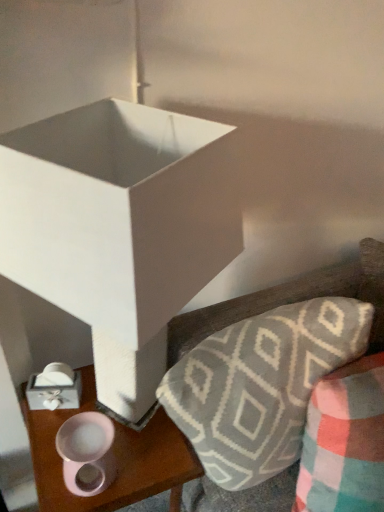
Question: Is pink matte candle holder at lower left next to textured gray pillow at upper right and touching it?

Choices:
 (A) yes
 (B) no

Answer: (B)

Question: Would you say pink matte candle holder at lower left is a long distance from textured gray pillow at upper right?

Choices:
 (A) no
 (B) yes

Answer: (A)

Question: Is textured gray pillow at upper right a part of pink matte candle holder at lower left?

Choices:
 (A) no
 (B) yes

Answer: (A)

Question: Is pink matte candle holder at lower left looking in the opposite direction of textured gray pillow at upper right?

Choices:
 (A) yes
 (B) no

Answer: (B)

Question: Is pink matte candle holder at lower left oriented towards textured gray pillow at upper right?

Choices:
 (A) yes
 (B) no

Answer: (B)

Question: Choose the correct answer: Is white matte box at center inside pink glossy mug at lower left or outside it?

Choices:
 (A) outside
 (B) inside

Answer: (A)

Question: Relative to pink glossy mug at lower left, is white matte box at center in front or behind?

Choices:
 (A) front
 (B) behind

Answer: (A)

Question: From a real-world perspective, is white matte box at center physically located above or below pink glossy mug at lower left?

Choices:
 (A) above
 (B) below

Answer: (A)

Question: Would you say white matte box at center is to the left or to the right of pink glossy mug at lower left in the picture?

Choices:
 (A) left
 (B) right

Answer: (B)

Question: From their relative heights in the image, would you say plush gray and white geometric-patterned throw pillow at lower right is taller or shorter than white matte box at center?

Choices:
 (A) tall
 (B) short

Answer: (B)

Question: Is plush gray and white geometric-patterned throw pillow at lower right situated inside white matte box at center or outside?

Choices:
 (A) inside
 (B) outside

Answer: (B)

Question: From a real-world perspective, is plush gray and white geometric-patterned throw pillow at lower right above or below white matte box at center?

Choices:
 (A) below
 (B) above

Answer: (A)

Question: Visually, is plush gray and white geometric-patterned throw pillow at lower right positioned to the left or to the right of white matte box at center?

Choices:
 (A) right
 (B) left

Answer: (A)

Question: From a real-world perspective, is pink glossy mug at lower left above or below plush gray and white geometric-patterned throw pillow at lower right?

Choices:
 (A) above
 (B) below

Answer: (B)

Question: Is pink glossy mug at lower left wider or thinner than plush gray and white geometric-patterned throw pillow at lower right?

Choices:
 (A) wide
 (B) thin

Answer: (B)